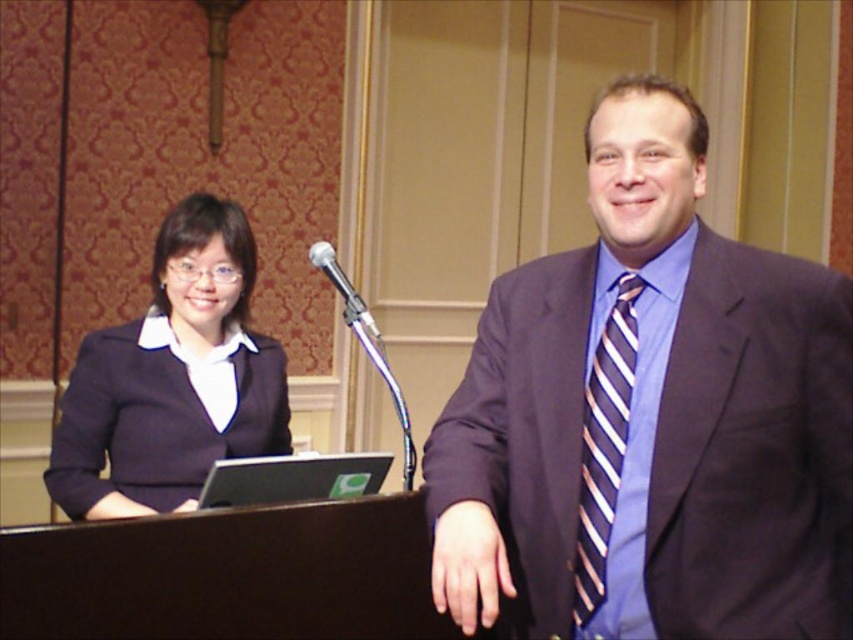
Is point (486, 349) farther from camera compared to point (83, 426)?

No, (486, 349) is closer to viewer.

Which is more to the right, dark purple suit at right or matte black blazer at left?

dark purple suit at right is more to the right.

Is point (469, 451) positioned after point (126, 481)?

No, it is in front of (126, 481).

Where is `dark purple suit at right`? Image resolution: width=853 pixels, height=640 pixels. dark purple suit at right is located at coordinates (650, 419).

Can you confirm if dark purple suit at right is positioned to the right of black plastic laptop at center?

Yes, dark purple suit at right is to the right of black plastic laptop at center.

In the scene shown: Between dark purple suit at right and black plastic laptop at center, which one is positioned lower?

Positioned lower is black plastic laptop at center.

Is point (550, 593) more distant than point (317, 472)?

No, (550, 593) is closer to viewer.

The width and height of the screenshot is (853, 640). What are the coordinates of `dark purple suit at right` in the screenshot? It's located at (650, 419).

Measure the distance between matte black blazer at left and camera.

1.93 meters

Where is `matte black blazer at left`? matte black blazer at left is located at coordinates (172, 378).

Consider the image. Who is more distant from viewer, (x=171, y=282) or (x=601, y=540)?

The point (x=171, y=282) is behind.

You are a GUI agent. You are given a task and a screenshot of the screen. Output one action in this format:
    pyautogui.click(x=<x>, y=<y>)
    Task: Click on the matte black blazer at left
    The height and width of the screenshot is (640, 853).
    Given the screenshot: What is the action you would take?
    pyautogui.click(x=172, y=378)